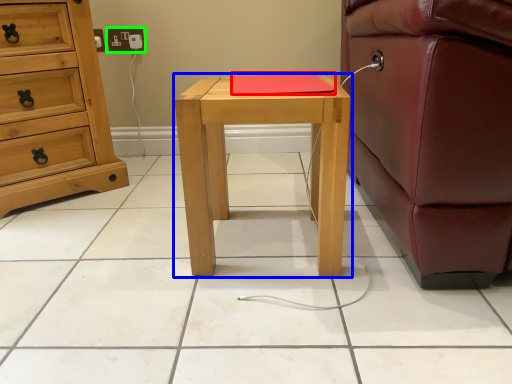
Question: Estimate the real-world distances between objects in this image. Which object is closer to pad (highlighted by a red box), nightstand (highlighted by a blue box) or electric outlet (highlighted by a green box)?

Choices:
 (A) nightstand
 (B) electric outlet

Answer: (A)